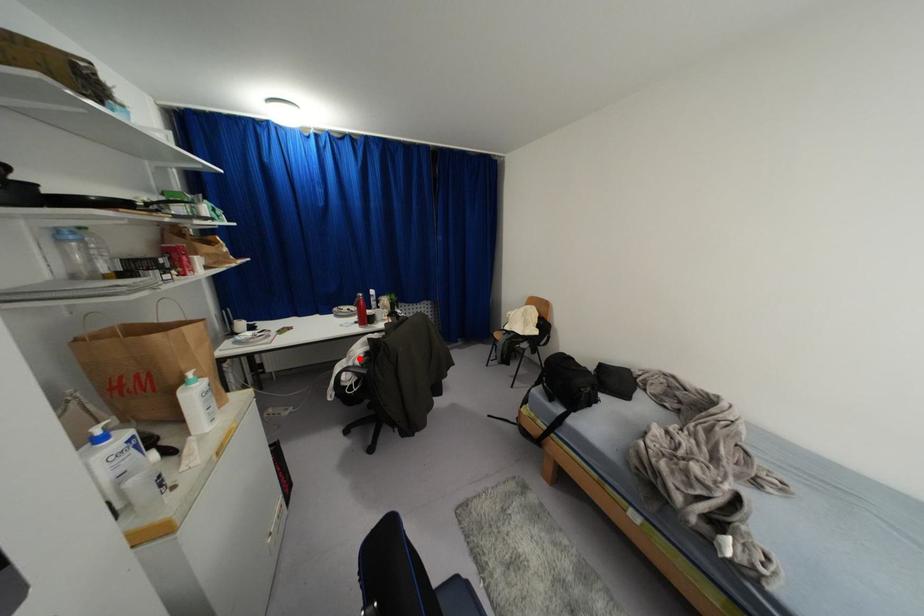
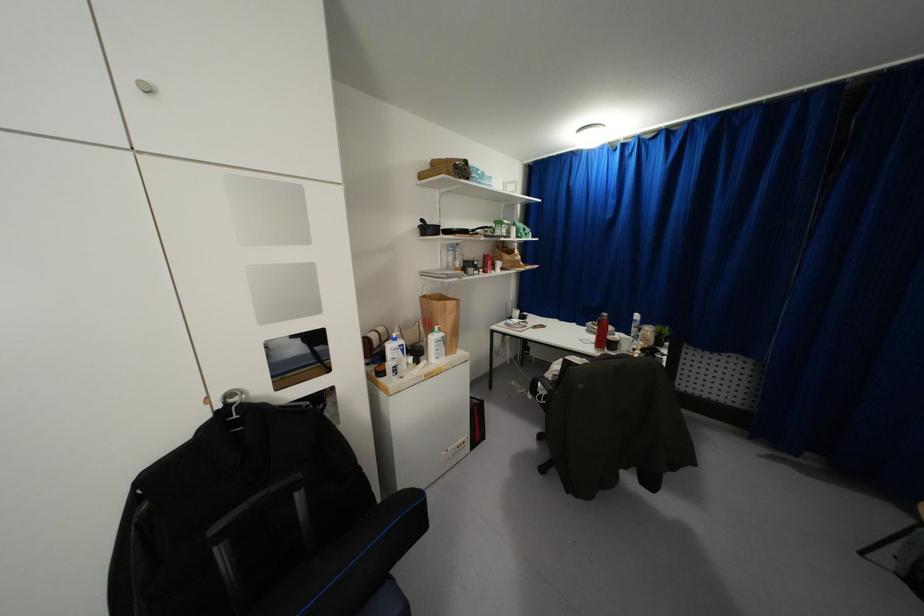
The point at the highlighted location is marked in the first image. Where is the corresponding point in the second image?

(553, 376)